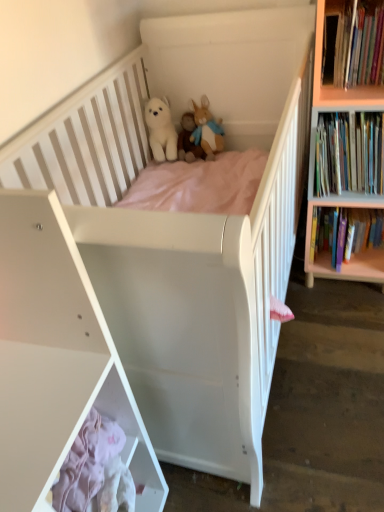
Question: Is fluffy beige rabbit at upper center, the 1th toy from the right, taller than hardcover books at upper right, arranged as the 1th book when viewed from the top?

Choices:
 (A) no
 (B) yes

Answer: (A)

Question: Is fluffy beige rabbit at upper center, the 1th toy from the right, oriented away from hardcover books at upper right, the 3th book ordered from the bottom?

Choices:
 (A) no
 (B) yes

Answer: (A)

Question: From the image's perspective, is fluffy beige rabbit at upper center, the 1th toy from the right, on top of hardcover books at upper right, arranged as the 1th book when viewed from the top?

Choices:
 (A) no
 (B) yes

Answer: (A)

Question: Is fluffy beige rabbit at upper center, the 1th toy from the right, positioned behind hardcover books at upper right, arranged as the 1th book when viewed from the top?

Choices:
 (A) no
 (B) yes

Answer: (B)

Question: Is fluffy beige rabbit at upper center, which is the 3th toy in left-to-right order, positioned before hardcover books at upper right, arranged as the 1th book when viewed from the top?

Choices:
 (A) no
 (B) yes

Answer: (A)

Question: In the image, is hardcover books at upper right, the 3th book ordered from the bottom, on the left side or the right side of white matte cabinet at lower left?

Choices:
 (A) right
 (B) left

Answer: (A)

Question: Is hardcover books at upper right, the 3th book ordered from the bottom, situated inside white matte cabinet at lower left or outside?

Choices:
 (A) outside
 (B) inside

Answer: (A)

Question: From the image's perspective, is hardcover books at upper right, arranged as the 1th book when viewed from the top, located above or below white matte cabinet at lower left?

Choices:
 (A) above
 (B) below

Answer: (A)

Question: From a real-world perspective, is hardcover books at upper right, the 3th book ordered from the bottom, physically located above or below white matte cabinet at lower left?

Choices:
 (A) above
 (B) below

Answer: (A)

Question: From the image's perspective, is fluffy beige rabbit at upper center, which is the 3th toy in left-to-right order, located above or below hardcover books at upper right, the 3th book ordered from the bottom?

Choices:
 (A) below
 (B) above

Answer: (A)

Question: From a real-world perspective, is fluffy beige rabbit at upper center, the 1th toy from the right, physically located above or below hardcover books at upper right, the 3th book ordered from the bottom?

Choices:
 (A) above
 (B) below

Answer: (B)

Question: Visually, is fluffy beige rabbit at upper center, which is the 3th toy in left-to-right order, positioned to the left or to the right of hardcover books at upper right, arranged as the 1th book when viewed from the top?

Choices:
 (A) left
 (B) right

Answer: (A)

Question: Which is correct: fluffy beige rabbit at upper center, which is the 3th toy in left-to-right order, is inside hardcover books at upper right, the 3th book ordered from the bottom, or outside of it?

Choices:
 (A) outside
 (B) inside

Answer: (A)

Question: From the image's perspective, relative to hardcover books at right, which ranks as the 3th book in top-to-bottom order, is fluffy beige rabbit at upper center, the 1th toy from the right, above or below?

Choices:
 (A) above
 (B) below

Answer: (A)

Question: In terms of size, does fluffy beige rabbit at upper center, which is the 3th toy in left-to-right order, appear bigger or smaller than hardcover books at right, arranged as the first book when ordered from the bottom?

Choices:
 (A) small
 (B) big

Answer: (A)